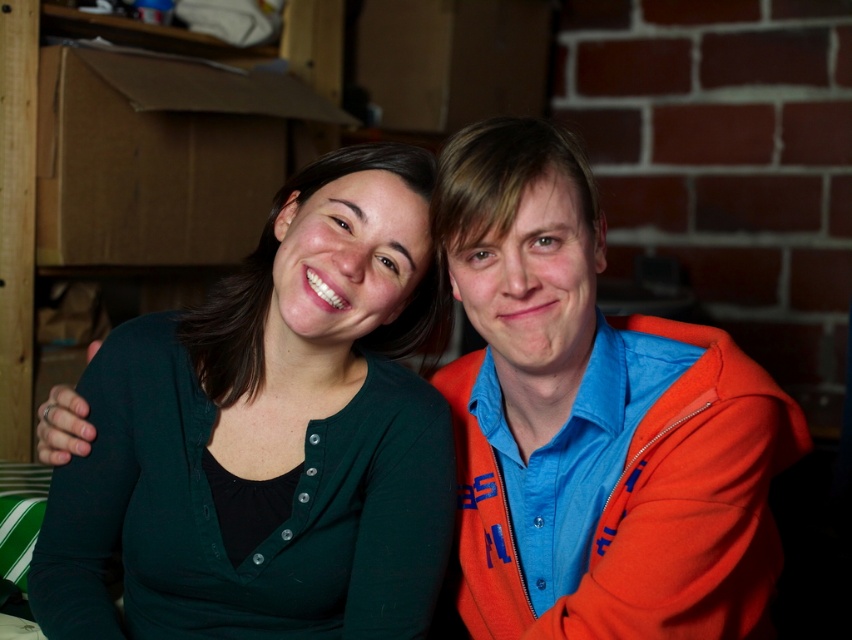
You are organizing a clothing store and need to arrange the green matte cardigan at center and orange fleece jacket at right on a shelf. According to the image, which item should be placed on the left side of the shelf?

The green matte cardigan at center should be placed on the left side of the shelf because it is positioned to the left of the orange fleece jacket at right in the image.

You are standing in the room and want to place a small decorative item exactly at the point marked as point [269,435]. What object will the item be placed on?

The small decorative item will be placed on the green matte cardigan at center located at point [269,435].